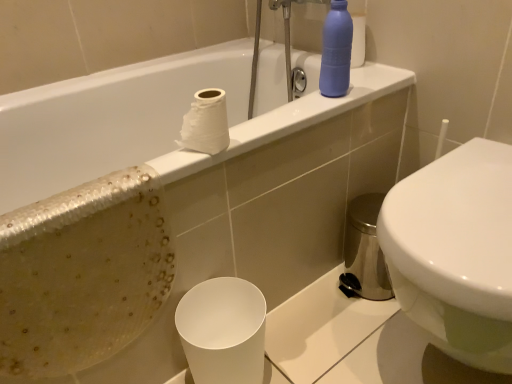
The width and height of the screenshot is (512, 384). What are the coordinates of `free location to the left of white matte toilet paper at upper center` in the screenshot? It's located at (124, 179).